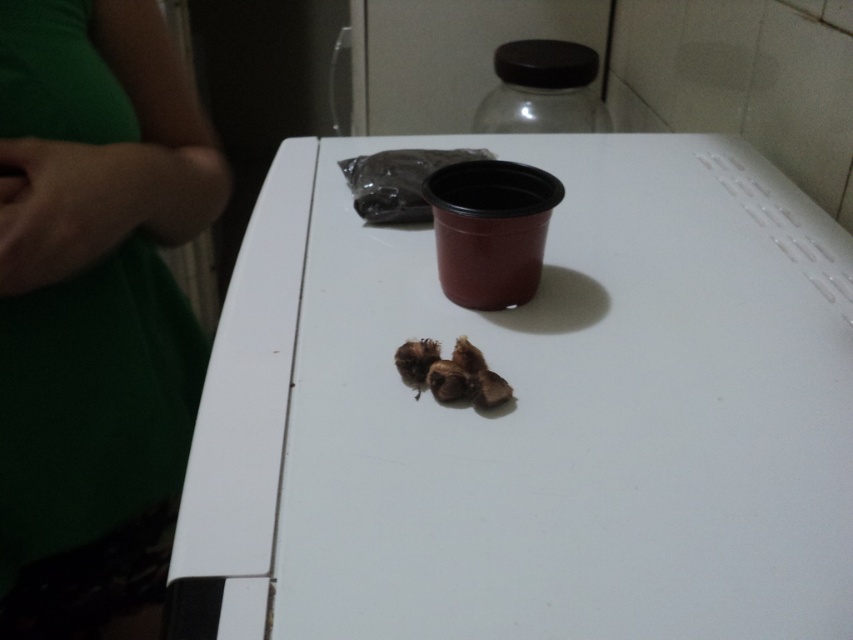
Question: Does green fabric at left have a larger size compared to brown matte nuts at center?

Choices:
 (A) yes
 (B) no

Answer: (A)

Question: Which object appears farthest from the camera in this image?

Choices:
 (A) brown matte nuts at center
 (B) white matte table at center
 (C) green fabric at left

Answer: (A)

Question: Estimate the real-world distances between objects in this image. Which object is closer to the brown matte nuts at center?

Choices:
 (A) green fabric at left
 (B) white matte table at center

Answer: (B)

Question: Which point is farther to the camera?

Choices:
 (A) white matte table at center
 (B) green fabric at left
 (C) brown matte nuts at center

Answer: (C)

Question: Can you confirm if white matte table at center is thinner than green fabric at left?

Choices:
 (A) no
 (B) yes

Answer: (A)

Question: Can you confirm if white matte table at center is smaller than brown matte nuts at center?

Choices:
 (A) no
 (B) yes

Answer: (A)